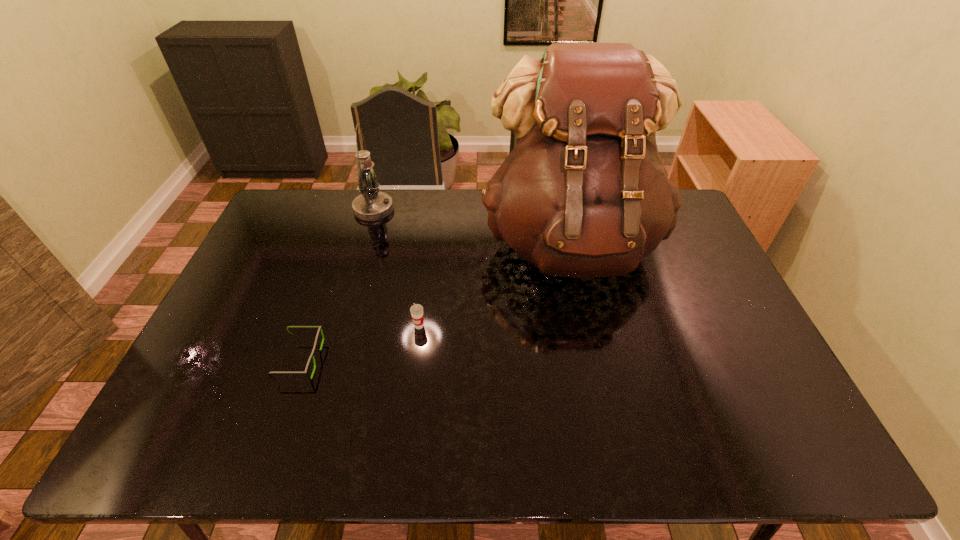
Where is `the tallest object`? The height and width of the screenshot is (540, 960). the tallest object is located at coordinates (584, 194).

Image resolution: width=960 pixels, height=540 pixels. Identify the location of satchel. (584, 194).

The height and width of the screenshot is (540, 960). Identify the location of the second tallest object. (371, 205).

The image size is (960, 540). Find the location of `the second nearest object`. the second nearest object is located at coordinates (416, 310).

What are the coordinates of `cup` in the screenshot? It's located at (416, 310).

Where is `spectacles`? The image size is (960, 540). spectacles is located at coordinates (320, 327).

At what (x,y) coordinates should I click in order to perform the action: click on the shortest object. Please return your answer as a coordinate pair (x, y). This screenshot has width=960, height=540. Looking at the image, I should click on (320, 327).

Find the location of `vacant space situated at the front of the tallest object with buckles`. vacant space situated at the front of the tallest object with buckles is located at coordinates (594, 348).

Locate an element on the screen. vacant space located on the front of the oil lamp is located at coordinates tap(360, 257).

This screenshot has height=540, width=960. Identify the location of free space located 0.240m on the side of the second nearest object with the logo. (408, 411).